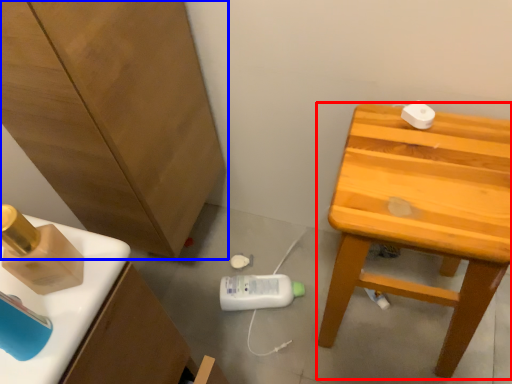
Question: Among these objects, which one is farthest to the camera, stool (highlighted by a red box) or cabinetry (highlighted by a blue box)?

Choices:
 (A) stool
 (B) cabinetry

Answer: (A)